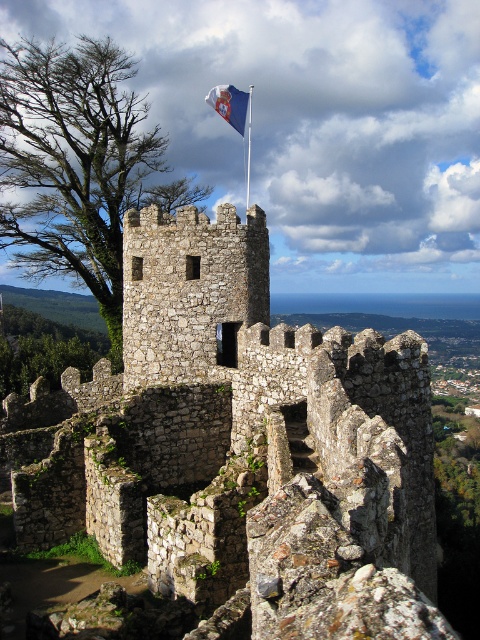
Which of these two, stone wall at center or blue fabric flag at upper center, stands shorter?

stone wall at center

Consider the image. Who is positioned more to the right, stone wall at center or blue fabric flag at upper center?

From the viewer's perspective, stone wall at center appears more on the right side.

From the picture: Who is more distant from viewer, (124,332) or (240,132)?

The point (240,132) is behind.

Where is `stone wall at center`? The height and width of the screenshot is (640, 480). stone wall at center is located at coordinates (240, 445).